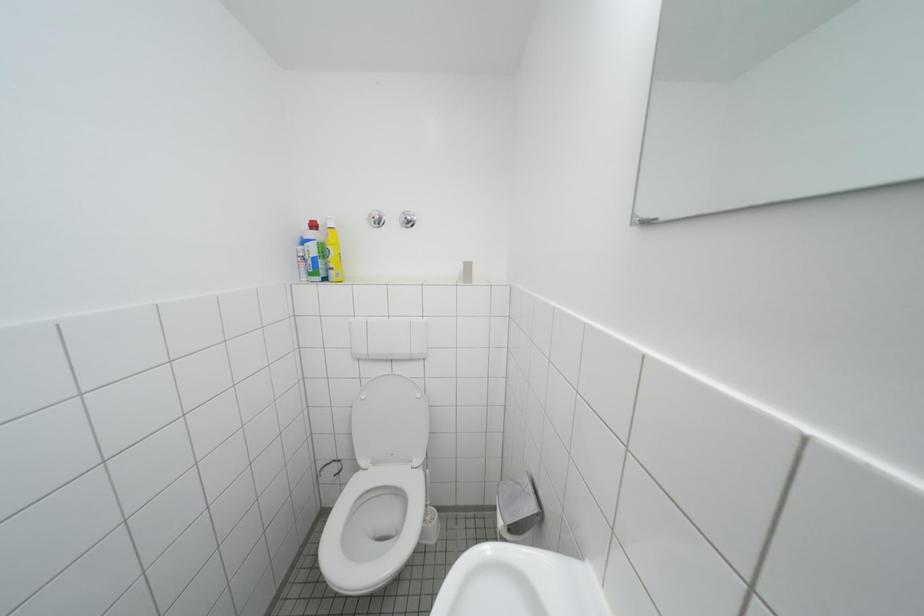
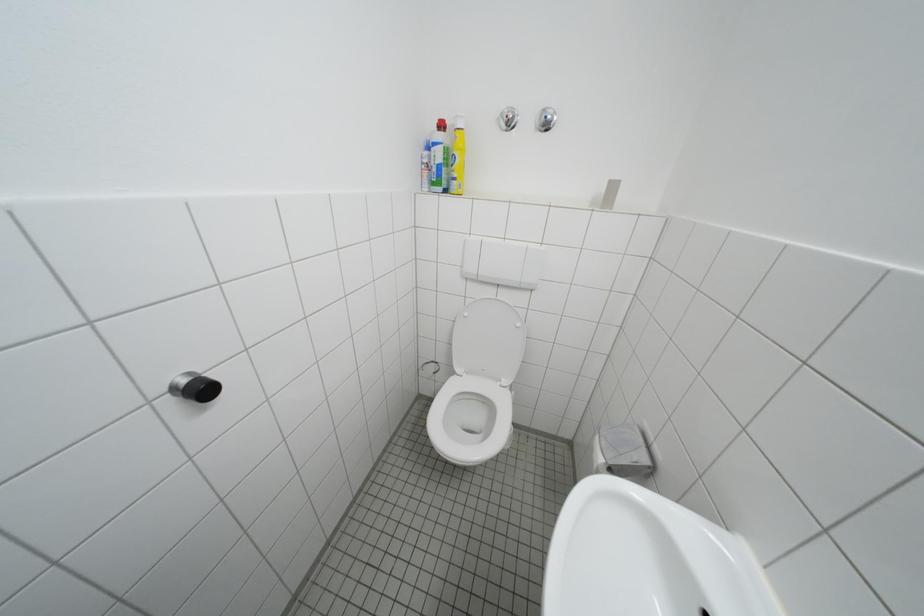
Question: What movement of the cameraman would produce the second image?

Choices:
 (A) Left
 (B) Right
 (C) Forward
 (D) Backward

Answer: (A)